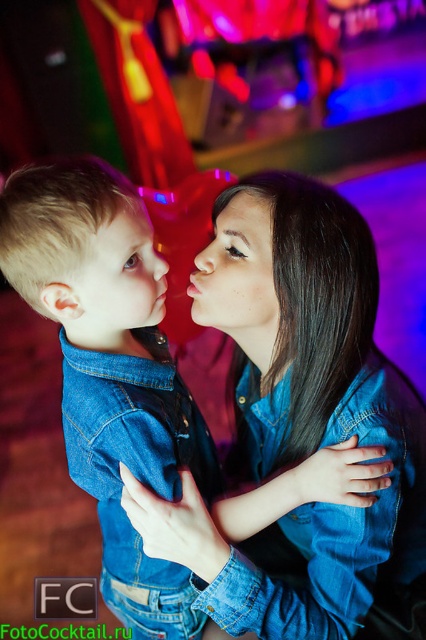
In the scene shown: You are a photographer who wants to capture a closeup shot of the matte skin forehead at upper center without including the faded denim jacket at lower right. Based on the scene description, is the jacket within the camera frame when focusing on the forehead?

The distance between the faded denim jacket at lower right and the matte skin forehead at upper center is 19.94 inches. Since the jacket is positioned far from the forehead, it would likely be outside the camera frame when focusing on the forehead.

You are a photographer who wants to adjust the focus to include the faded denim jacket at lower right in the foreground. What coordinates should you focus on?

The faded denim jacket at lower right is located at point (336, 529), so you should focus on those coordinates to include it in the foreground.